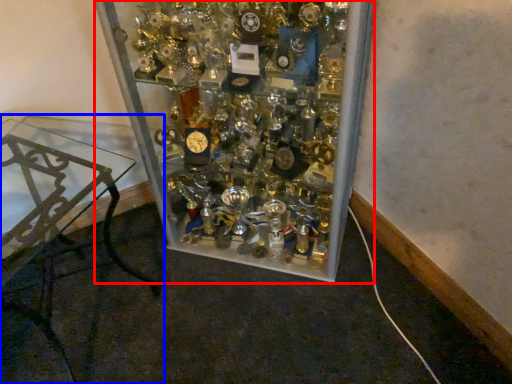
Question: Which point is further to the camera, glass box (highlighted by a red box) or furniture (highlighted by a blue box)?

Choices:
 (A) glass box
 (B) furniture

Answer: (A)